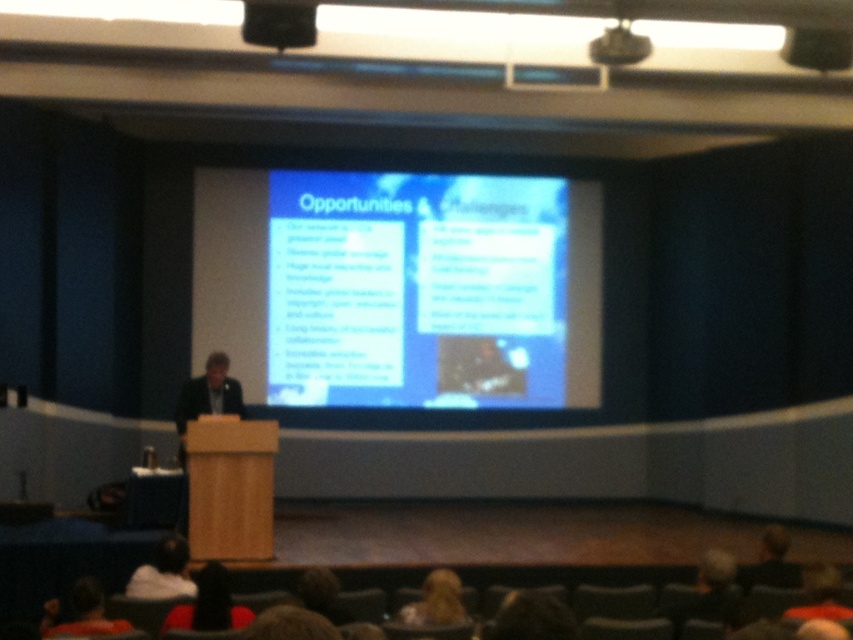
Does black fabric head at lower center have a smaller size compared to dark brown hair at lower left?

Yes.

You are a GUI agent. You are given a task and a screenshot of the screen. Output one action in this format:
    pyautogui.click(x=<x>, y=<y>)
    Task: Click on the black fabric head at lower center
    This screenshot has width=853, height=640.
    Given the screenshot: What is the action you would take?
    pyautogui.click(x=209, y=604)

Who is shorter, dark brown hair at lower center or dark brown hair at lower left?

Standing shorter between the two is dark brown hair at lower center.

Is dark brown hair at lower center below dark brown hair at lower left?

No.

Does point (556, 625) lie in front of point (78, 588)?

Yes.

You are a GUI agent. You are given a task and a screenshot of the screen. Output one action in this format:
    pyautogui.click(x=<x>, y=<y>)
    Task: Click on the dark brown hair at lower center
    
    Given the screenshot: What is the action you would take?
    pyautogui.click(x=531, y=618)

Which is more to the right, dark suit at center or blonde hair at lower center?

From the viewer's perspective, blonde hair at lower center appears more on the right side.

Who is more forward, (183, 403) or (445, 579)?

Point (445, 579)

Identify the location of dark suit at center. (207, 394).